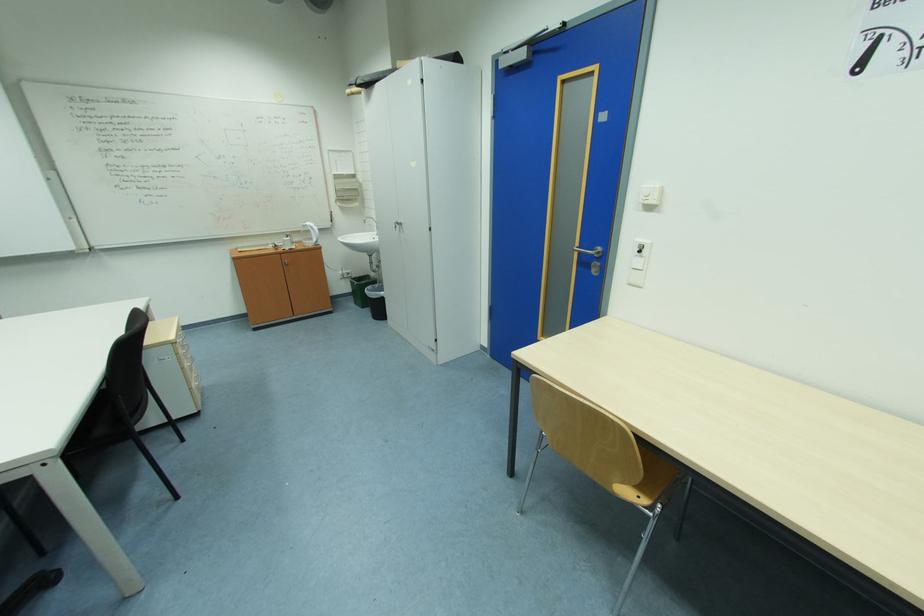
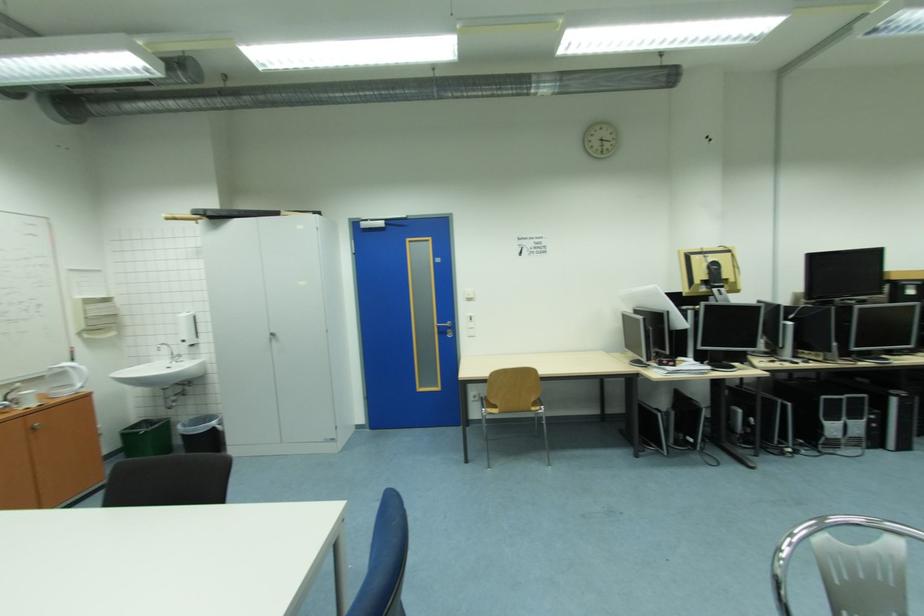
Where in the second image is the point corresponding to (405,227) from the first image?

(278, 338)